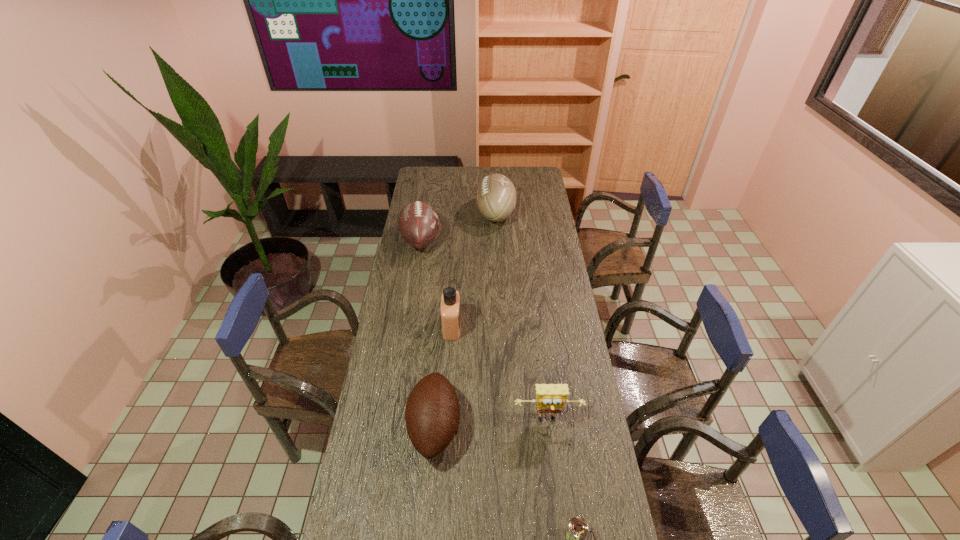
Image resolution: width=960 pixels, height=540 pixels. I want to click on object that is positioned at the right edge, so click(x=550, y=398).

Locate an element on the screen. vacant area at the far edge of the desktop is located at coordinates (465, 170).

This screenshot has width=960, height=540. Find the location of `vacant space at the left edge`. vacant space at the left edge is located at coordinates (424, 261).

At what (x,y) coordinates should I click in order to perform the action: click on free region at the right edge of the desktop. Please return your answer as a coordinate pair (x, y). This screenshot has width=960, height=540. Looking at the image, I should click on (561, 271).

At what (x,y) coordinates should I click in order to perform the action: click on vacant space at the far left corner. Please return your answer as a coordinate pair (x, y). This screenshot has height=540, width=960. Looking at the image, I should click on (425, 167).

The width and height of the screenshot is (960, 540). What are the coordinates of `vacant space at the far right corner of the desktop` in the screenshot? It's located at (531, 172).

Identify the location of vacant point located between the rightmost football and the nearest football. The width and height of the screenshot is (960, 540). (466, 320).

This screenshot has width=960, height=540. Find the location of `vacant point located between the perfume and the sponge`. vacant point located between the perfume and the sponge is located at coordinates (500, 374).

This screenshot has width=960, height=540. In order to click on vacant area that lies between the rightmost football and the sponge in this screenshot , I will do `click(521, 317)`.

This screenshot has height=540, width=960. I want to click on unoccupied area between the sponge and the nearest football, so click(x=492, y=423).